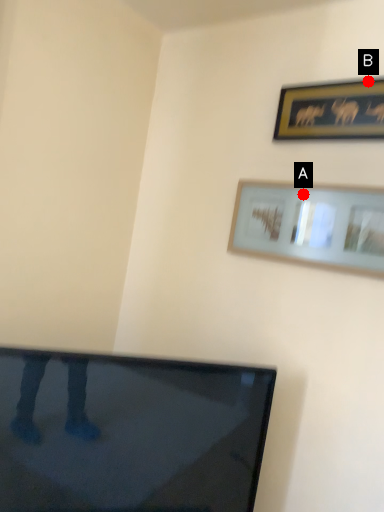
Question: Two points are circled on the image, labeled by A and B beside each circle. Which point appears farthest from the camera in this image?

Choices:
 (A) A is further
 (B) B is further

Answer: (A)